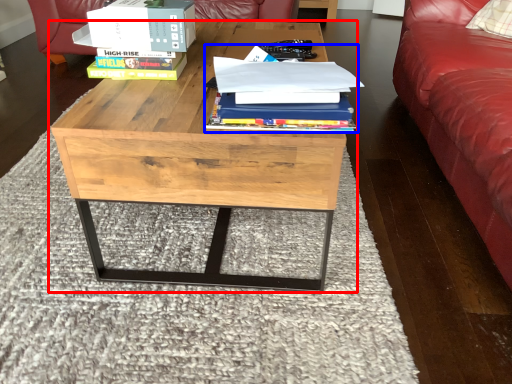
Question: Which point is further to the camera, coffee table (highlighted by a red box) or book (highlighted by a blue box)?

Choices:
 (A) coffee table
 (B) book

Answer: (A)